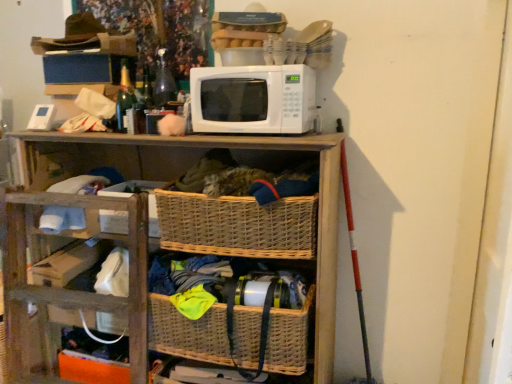
Question: Is white cardboard box at center, which ranks as the 1th storage box in bottom-to-top order, bigger than woven brown basket at center, which ranks as the 1th basket in top-to-bottom order?

Choices:
 (A) yes
 (B) no

Answer: (B)

Question: Does white cardboard box at center, which ranks as the 1th storage box in bottom-to-top order, turn towards woven brown basket at center, which is the 2th basket from bottom to top?

Choices:
 (A) no
 (B) yes

Answer: (A)

Question: Can you see white cardboard box at center, the 2th storage box from the top, touching woven brown basket at center, which is the 2th basket from bottom to top?

Choices:
 (A) no
 (B) yes

Answer: (A)

Question: From the image's perspective, does white cardboard box at center, the 2th storage box from the top, appear lower than woven brown basket at center, which ranks as the 1th basket in top-to-bottom order?

Choices:
 (A) no
 (B) yes

Answer: (A)

Question: Is the depth of white cardboard box at center, which ranks as the 1th storage box in bottom-to-top order, greater than that of woven brown basket at center, which ranks as the 1th basket in top-to-bottom order?

Choices:
 (A) yes
 (B) no

Answer: (A)

Question: Is white cardboard box at center, the 2th storage box from the top, at the right side of woven brown basket at center, which ranks as the 1th basket in top-to-bottom order?

Choices:
 (A) yes
 (B) no

Answer: (B)

Question: Is white matte microwave at upper center positioned in front of blue cardboard box at upper left, which appears as the second storage box when ordered from the bottom?

Choices:
 (A) yes
 (B) no

Answer: (A)

Question: Can you confirm if white matte microwave at upper center is wider than blue cardboard box at upper left, the first storage box when ordered from top to bottom?

Choices:
 (A) no
 (B) yes

Answer: (B)

Question: Can you confirm if white matte microwave at upper center is smaller than blue cardboard box at upper left, the first storage box when ordered from top to bottom?

Choices:
 (A) yes
 (B) no

Answer: (B)

Question: Considering the relative positions of white matte microwave at upper center and blue cardboard box at upper left, which appears as the second storage box when ordered from the bottom, in the image provided, is white matte microwave at upper center to the left of blue cardboard box at upper left, which appears as the second storage box when ordered from the bottom, from the viewer's perspective?

Choices:
 (A) no
 (B) yes

Answer: (A)

Question: Are white matte microwave at upper center and blue cardboard box at upper left, the first storage box when ordered from top to bottom, beside each other?

Choices:
 (A) yes
 (B) no

Answer: (B)

Question: Does white matte microwave at upper center turn towards blue cardboard box at upper left, which appears as the second storage box when ordered from the bottom?

Choices:
 (A) no
 (B) yes

Answer: (A)

Question: From the image's perspective, would you say green glass bottle at upper left is shown under woven wood shelf at center?

Choices:
 (A) yes
 (B) no

Answer: (B)